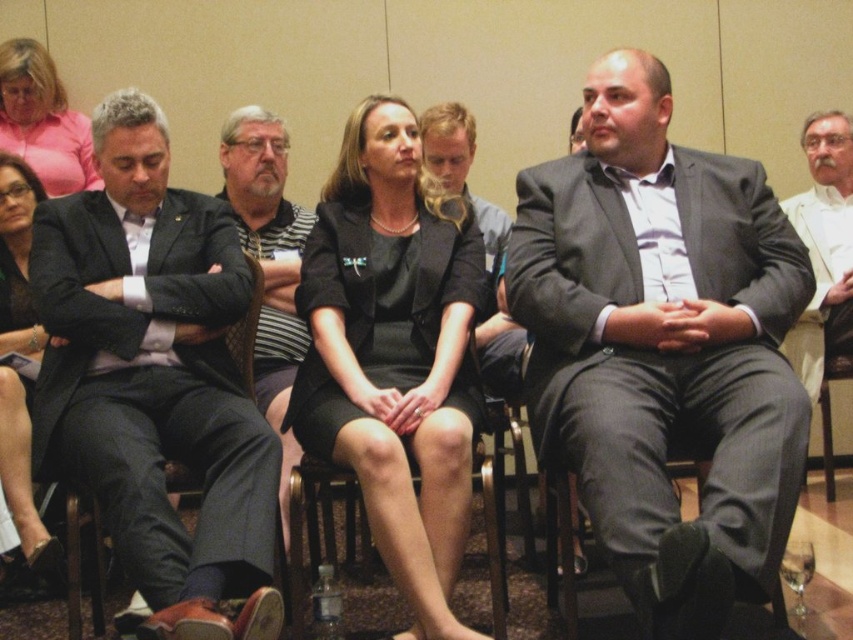
You are standing in the room and want to point to the exact location of the point at coordinates (155, 378). Which object in the scene does this point correspond to?

The point at coordinates (155, 378) corresponds to the dark gray suit at left.